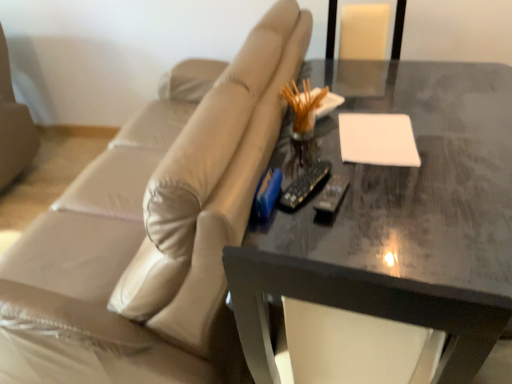
Question: Can you confirm if beige leather couch at center is bigger than white matte notepad at upper right?

Choices:
 (A) no
 (B) yes

Answer: (B)

Question: From a real-world perspective, is beige leather couch at center located higher than white matte notepad at upper right?

Choices:
 (A) yes
 (B) no

Answer: (B)

Question: Can you confirm if beige leather couch at center is positioned to the left of white matte notepad at upper right?

Choices:
 (A) no
 (B) yes

Answer: (B)

Question: Considering the relative positions of beige leather couch at center and white matte notepad at upper right in the image provided, is beige leather couch at center to the right of white matte notepad at upper right from the viewer's perspective?

Choices:
 (A) no
 (B) yes

Answer: (A)

Question: From a real-world perspective, is beige leather couch at center located beneath white matte notepad at upper right?

Choices:
 (A) yes
 (B) no

Answer: (A)

Question: Is beige leather couch at center positioned in front of white matte notepad at upper right?

Choices:
 (A) yes
 (B) no

Answer: (A)

Question: Does shiny dark gray table at center have a lesser width compared to beige leather couch at center?

Choices:
 (A) no
 (B) yes

Answer: (B)

Question: Is shiny dark gray table at center taller than beige leather couch at center?

Choices:
 (A) yes
 (B) no

Answer: (B)

Question: Is the depth of shiny dark gray table at center greater than that of beige leather couch at center?

Choices:
 (A) no
 (B) yes

Answer: (B)

Question: Is shiny dark gray table at center not close to beige leather couch at center?

Choices:
 (A) no
 (B) yes

Answer: (A)

Question: Is shiny dark gray table at center closer to camera compared to beige leather couch at center?

Choices:
 (A) yes
 (B) no

Answer: (B)

Question: Is shiny dark gray table at center beside beige leather couch at center?

Choices:
 (A) yes
 (B) no

Answer: (B)

Question: Is beige leather couch at center completely or partially inside black plastic remote at center?

Choices:
 (A) yes
 (B) no

Answer: (B)